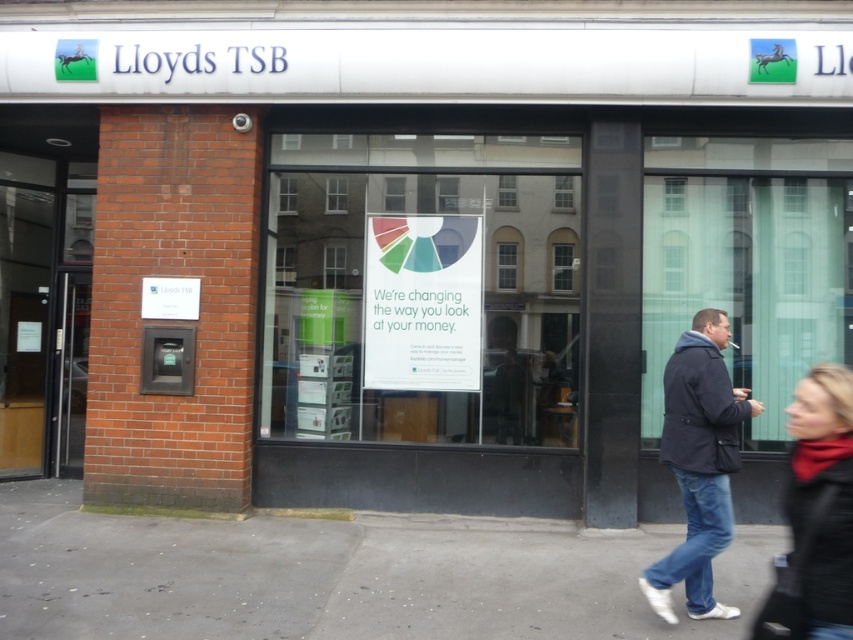
You are a customer standing in front of the Lloyds TSB bank branch. You notice the gray concrete pavement at lower center and the dark blue jacket at right. Which object occupies more space in the scene?

The gray concrete pavement at lower center has a larger size compared to the dark blue jacket at right, so it occupies more space in the scene.

You are standing in front of the Lloyds TSB bank branch and see two points marked on the building. One is at coordinate point (465, 324) and the other at point (808, 561). Which point is closer to you?

Point (465, 324) is closer to you because it is further to the viewer than point (808, 561).

You are a delivery person who needs to park your van near the Lloyds TSB bank entrance. You see the gray concrete pavement at lower center and the black leather jacket at lower right. Which surface can accommodate a larger vehicle like a van?

The gray concrete pavement at lower center is bigger than the black leather jacket at lower right, so the gray concrete pavement at lower center can accommodate a larger vehicle like a van.